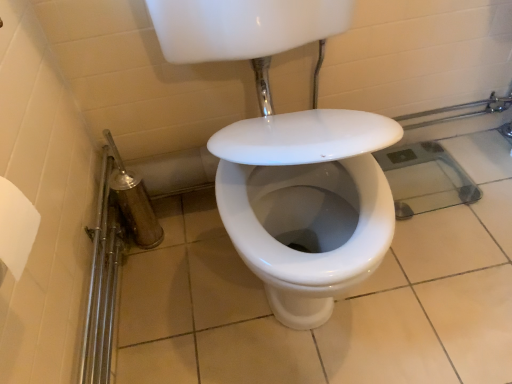
This screenshot has height=384, width=512. I want to click on vacant area that is situated to the right of white glossy sink at center, so click(x=457, y=256).